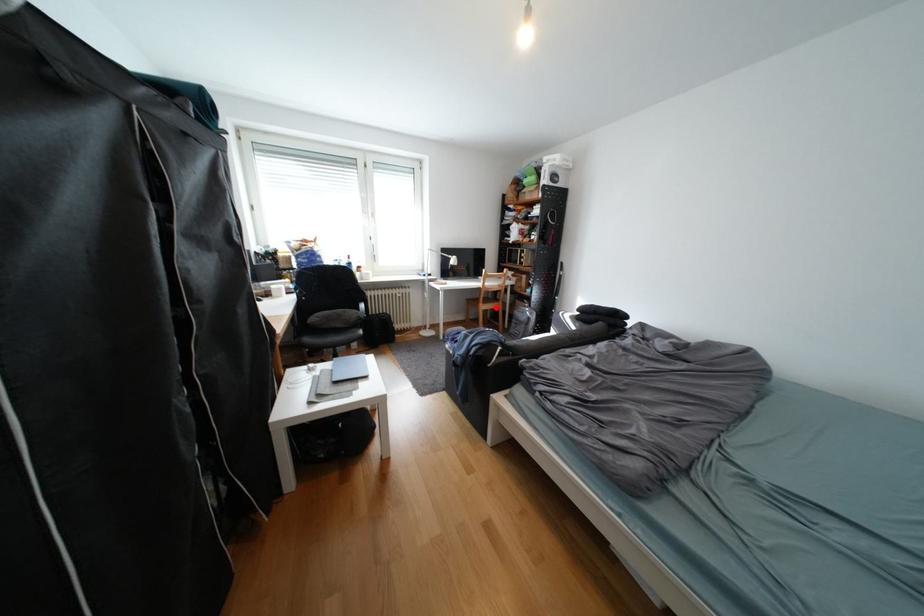
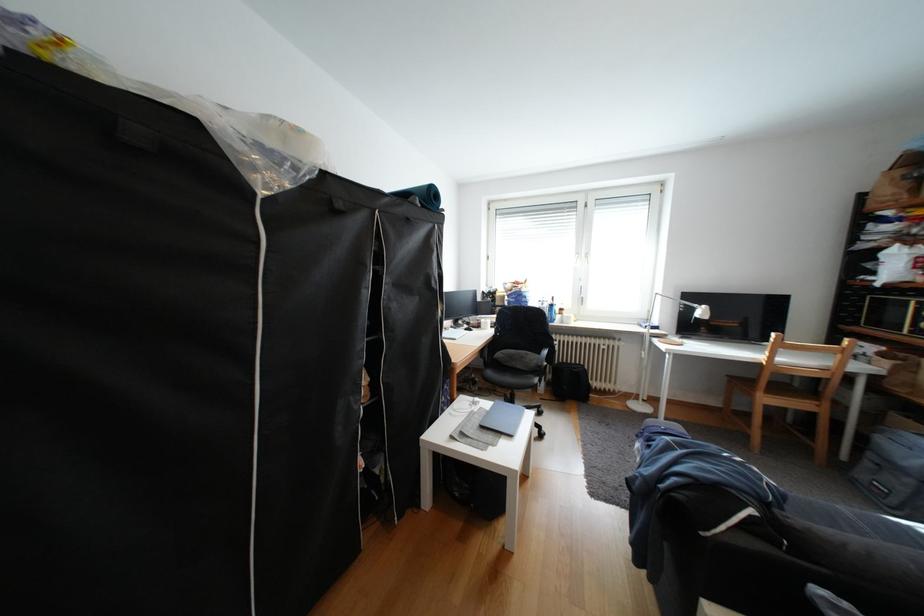
Question: I am providing you with two images of the same scene from different viewpoints. A red point is shown in image1. For the corresponding object point in image2, is it positioned nearer or farther from the camera?

Choices:
 (A) Nearer
 (B) Farther

Answer: (A)